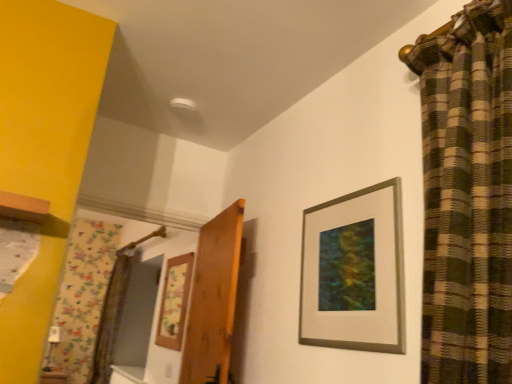
Question: From a real-world perspective, is silver/metallic picture frame at upper right, which is counted as the second picture frame, starting from the left, above or below wooden picture frame at center, acting as the first picture frame starting from the back?

Choices:
 (A) below
 (B) above

Answer: (B)

Question: Is silver/metallic picture frame at upper right, placed as the 1th picture frame when sorted from top to bottom, to the left or to the right of wooden picture frame at center, the second picture frame viewed from the top, in the image?

Choices:
 (A) right
 (B) left

Answer: (A)

Question: Estimate the real-world distances between objects in this image. Which object is closer to the wooden picture frame at center, placed as the first picture frame when sorted from left to right?

Choices:
 (A) wooden door at center
 (B) silver/metallic picture frame at upper right, which is counted as the second picture frame, starting from the left

Answer: (A)

Question: Estimate the real-world distances between objects in this image. Which object is closer to the wooden picture frame at center, which is the second picture frame from right to left?

Choices:
 (A) silver/metallic picture frame at upper right, placed as the 1th picture frame when sorted from top to bottom
 (B) wooden door at center

Answer: (B)